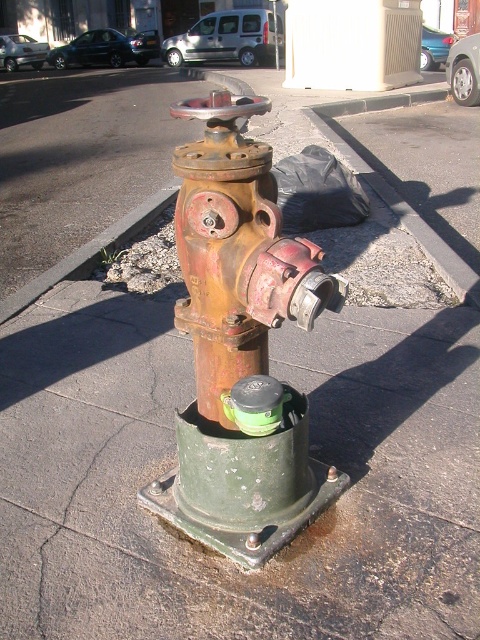
In the scene shown: Which is above, rusty metal hydrant at center or rusty metal curb at lower left?

rusty metal curb at lower left is higher up.

Measure the distance from rusty metal hydrant at center to rusty metal curb at lower left.

rusty metal hydrant at center and rusty metal curb at lower left are 2.59 meters apart.

You are a GUI agent. You are given a task and a screenshot of the screen. Output one action in this format:
    pyautogui.click(x=<x>, y=<y>)
    Task: Click on the rusty metal hydrant at center
    The image size is (480, 640).
    Given the screenshot: What is the action you would take?
    pyautogui.click(x=238, y=252)